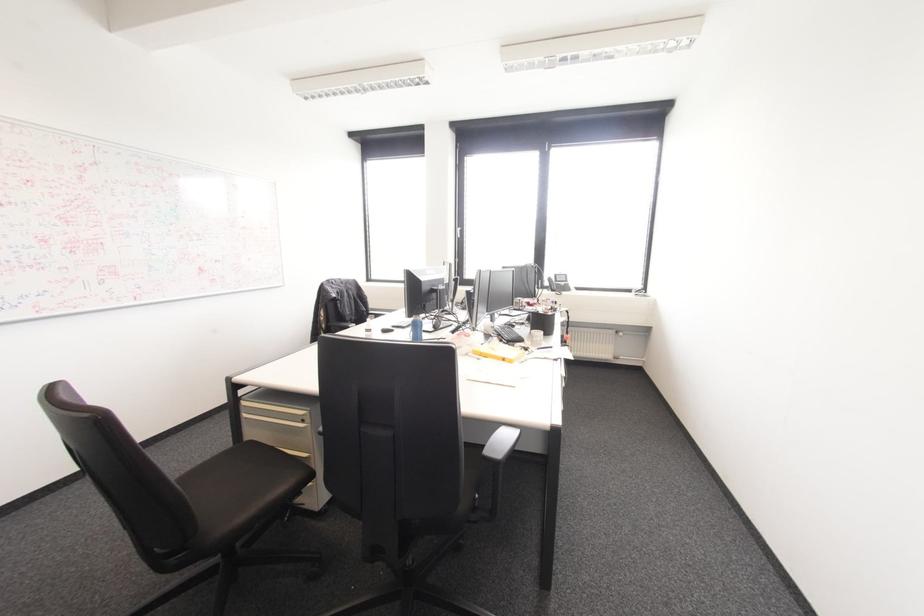
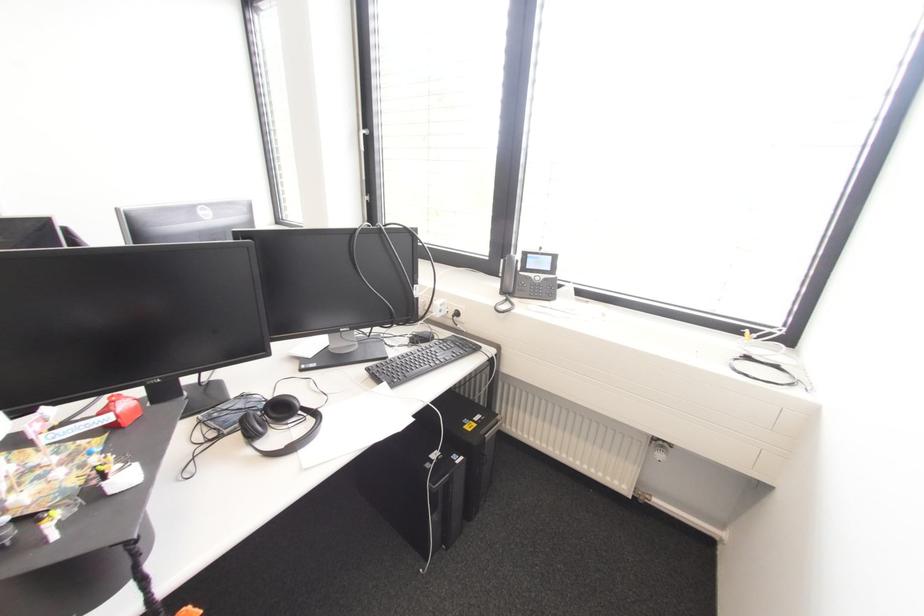
The point at [457,228] is marked in the first image. Where is the corresponding point in the second image?

(361, 132)